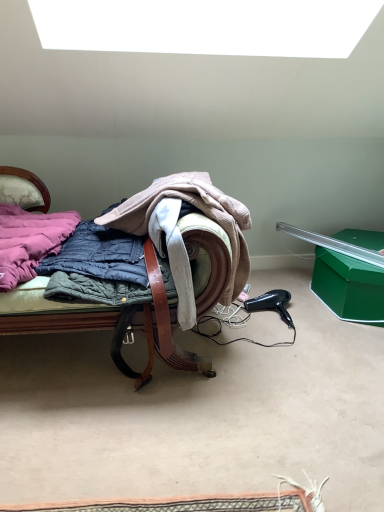
I want to click on unoccupied region to the right of black plastic hair dryer at lower right, so click(326, 318).